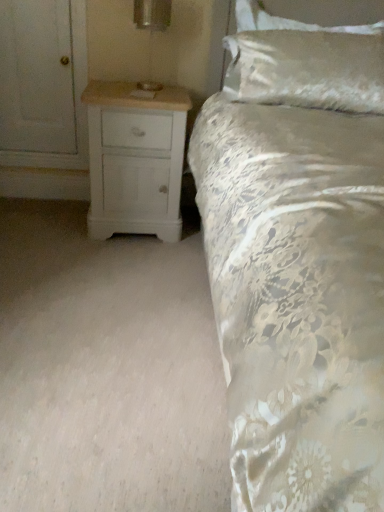
Question: From the image's perspective, is silky white pillow at upper right on white wood chest of drawers at lower left?

Choices:
 (A) no
 (B) yes

Answer: (B)

Question: Is silky white pillow at upper right positioned behind white wood chest of drawers at lower left?

Choices:
 (A) yes
 (B) no

Answer: (A)

Question: Can you confirm if silky white pillow at upper right is taller than white wood chest of drawers at lower left?

Choices:
 (A) no
 (B) yes

Answer: (A)

Question: Can you confirm if silky white pillow at upper right is thinner than white wood chest of drawers at lower left?

Choices:
 (A) no
 (B) yes

Answer: (B)

Question: Is silky white pillow at upper right facing away from white wood chest of drawers at lower left?

Choices:
 (A) no
 (B) yes

Answer: (A)

Question: From the image's perspective, is white wood chest of drawers at lower left above or below metallic silver table lamp at upper center?

Choices:
 (A) below
 (B) above

Answer: (A)

Question: Based on their sizes in the image, would you say white wood chest of drawers at lower left is bigger or smaller than metallic silver table lamp at upper center?

Choices:
 (A) small
 (B) big

Answer: (B)

Question: From a real-world perspective, is white wood chest of drawers at lower left above or below metallic silver table lamp at upper center?

Choices:
 (A) below
 (B) above

Answer: (A)

Question: Is white wood chest of drawers at lower left taller or shorter than metallic silver table lamp at upper center?

Choices:
 (A) short
 (B) tall

Answer: (B)

Question: From their relative heights in the image, would you say white wood chest of drawers at lower left is taller or shorter than silky white pillow at upper right?

Choices:
 (A) tall
 (B) short

Answer: (A)

Question: Is white wood chest of drawers at lower left inside or outside of silky white pillow at upper right?

Choices:
 (A) outside
 (B) inside

Answer: (A)

Question: From the image's perspective, is white wood chest of drawers at lower left located above or below silky white pillow at upper right?

Choices:
 (A) below
 (B) above

Answer: (A)

Question: Relative to silky white pillow at upper right, is white wood chest of drawers at lower left in front or behind?

Choices:
 (A) front
 (B) behind

Answer: (A)

Question: From a real-world perspective, is silky white pillow at upper right positioned above or below metallic silver table lamp at upper center?

Choices:
 (A) below
 (B) above

Answer: (B)

Question: Is silky white pillow at upper right in front of or behind metallic silver table lamp at upper center in the image?

Choices:
 (A) behind
 (B) front

Answer: (A)